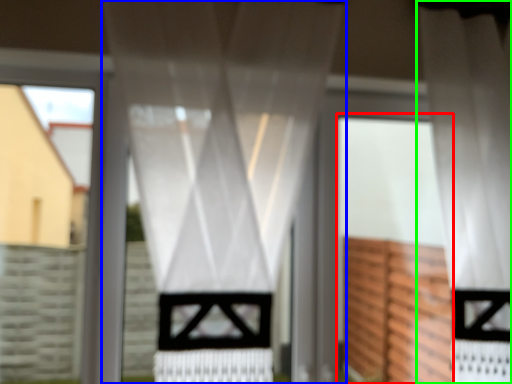
Question: Considering the real-world distances, which object is closest to screen door (highlighted by a red box)? curtain (highlighted by a blue box) or curtain (highlighted by a green box).

Choices:
 (A) curtain
 (B) curtain

Answer: (B)